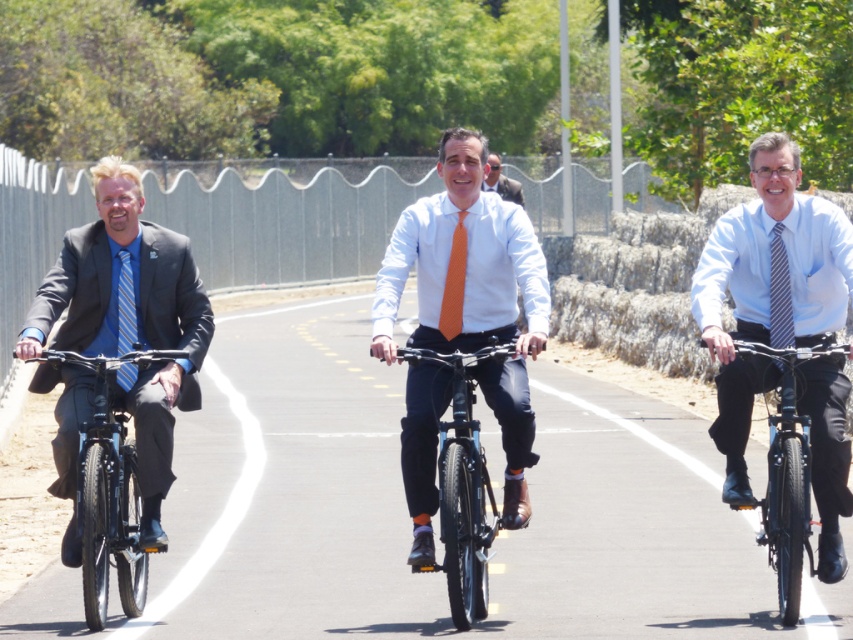
Is light blue shirt and tie at center bigger than matte black suit at left?

Indeed, light blue shirt and tie at center has a larger size compared to matte black suit at left.

Who is more distant from viewer, (711, 340) or (68, 316)?

The point (68, 316) is more distant.

Image resolution: width=853 pixels, height=640 pixels. Find the location of `light blue shirt and tie at center`. light blue shirt and tie at center is located at coordinates (769, 289).

Is light blue shirt and tie at center wider than blue striped tie at left?

Yes, light blue shirt and tie at center is wider than blue striped tie at left.

The width and height of the screenshot is (853, 640). Describe the element at coordinates (769, 289) in the screenshot. I see `light blue shirt and tie at center` at that location.

Where is `light blue shirt and tie at center`? light blue shirt and tie at center is located at coordinates (769, 289).

Find the location of a particular element. Image resolution: width=853 pixels, height=640 pixels. orange satin tie at center is located at coordinates (454, 282).

Can you confirm if orange satin tie at center is taller than blue striped tie at left?

No.

Consider the image. Who is more distant from viewer, [454,268] or [126,250]?

The point [126,250] is behind.

Where is `orange satin tie at center`? Image resolution: width=853 pixels, height=640 pixels. orange satin tie at center is located at coordinates (454, 282).